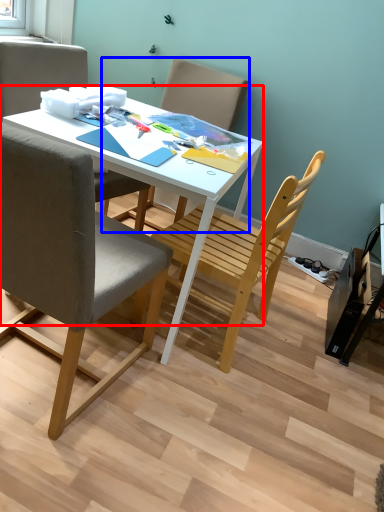
Question: Which object appears closest to the camera in this image, desk (highlighted by a red box) or chair (highlighted by a blue box)?

Choices:
 (A) desk
 (B) chair

Answer: (A)